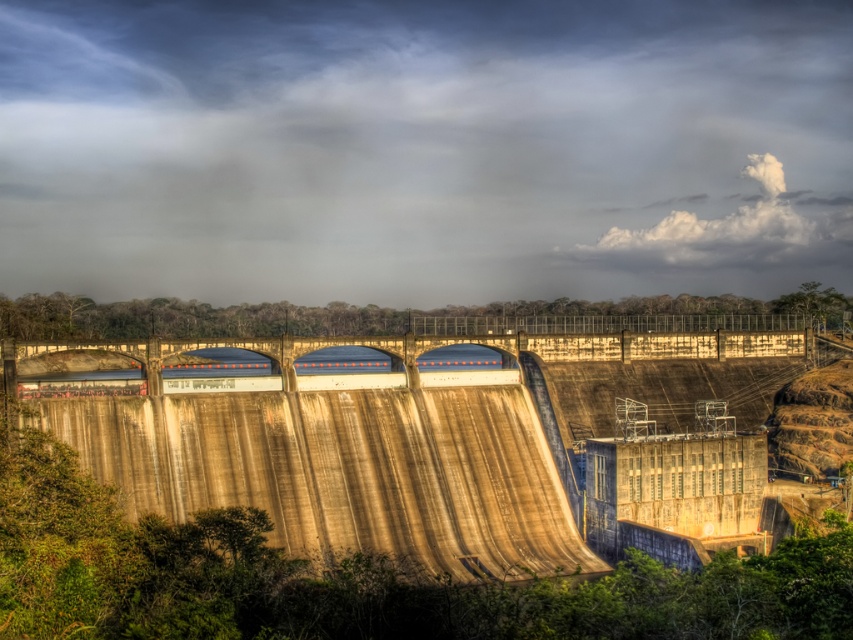
Question: Is cloudy sky at upper center to the left of concrete dam at center from the viewer's perspective?

Choices:
 (A) yes
 (B) no

Answer: (B)

Question: Which object is farther from the camera taking this photo?

Choices:
 (A) cloudy sky at upper center
 (B) concrete dam at center

Answer: (A)

Question: Does cloudy sky at upper center have a greater width compared to concrete dam at center?

Choices:
 (A) yes
 (B) no

Answer: (A)

Question: Is cloudy sky at upper center below concrete dam at center?

Choices:
 (A) yes
 (B) no

Answer: (B)

Question: Which point is farther from the camera taking this photo?

Choices:
 (A) (178, 509)
 (B) (167, 120)

Answer: (B)